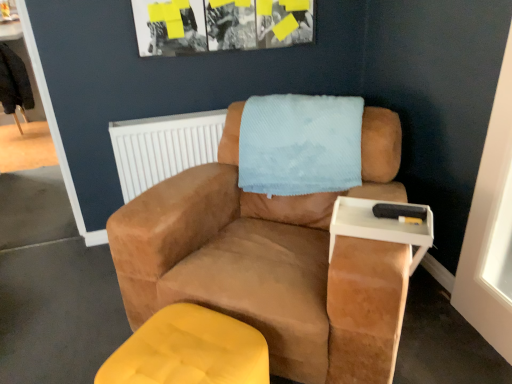
At what (x,y) coordinates should I click in order to perform the action: click on blank space situated above white plastic radiator at upper center (from a real-world perspective). Please return your answer as a coordinate pair (x, y). Looking at the image, I should click on (167, 118).